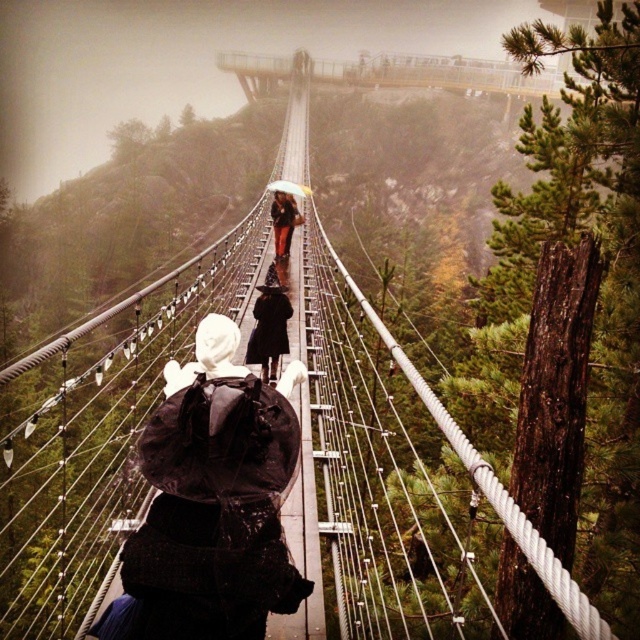
You are standing on the suspension bridge and notice the black matte coat at center. Based on its position, can you determine if it is closer to the camera or the distant viewing platform?

The black matte coat at center is located at point coordinates that are closer to the camera than the distant viewing platform, so it is closer to the camera.

Based on the photo, you are a photographer standing on the suspension bridge and want to take a photo of the two people wearing the black matte coat at center and dark brown leather jacket at center. Which clothing item is more suitable to be in the foreground to emphasize its details?

The black matte coat at center is smaller than the dark brown leather jacket at center, so to emphasize details, the smaller black matte coat at center should be placed in the foreground because smaller objects can be focused on more clearly when closer to the camera.

You are standing at the starting point of the suspension bridge and see two points marked on the bridge. The first point is at coordinates point (417, 77) and the second point is at point (285, 221). If you were to walk towards the distant viewing platform, which point would you encounter first?

You would encounter point (285, 221) first because it is ahead of point (417, 77) along the bridge path.